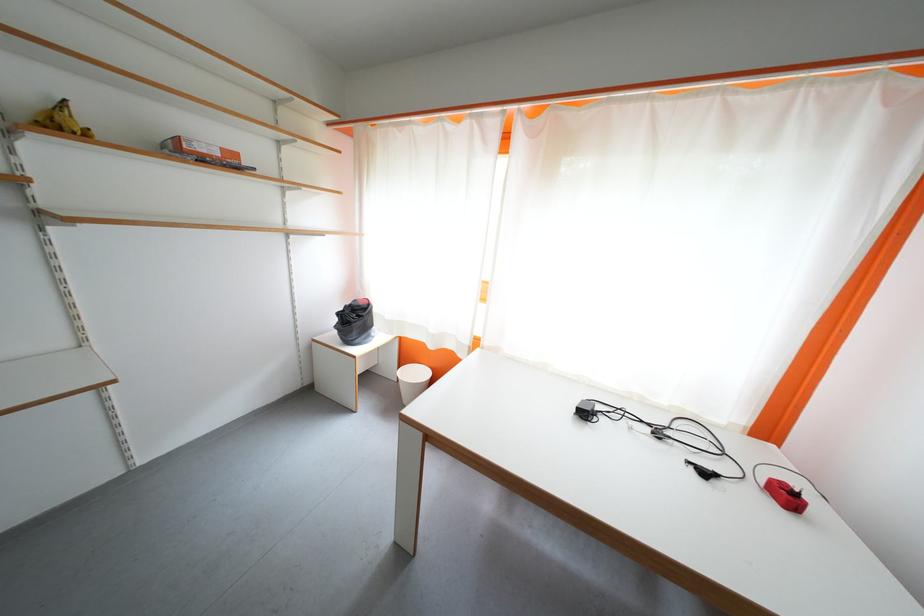
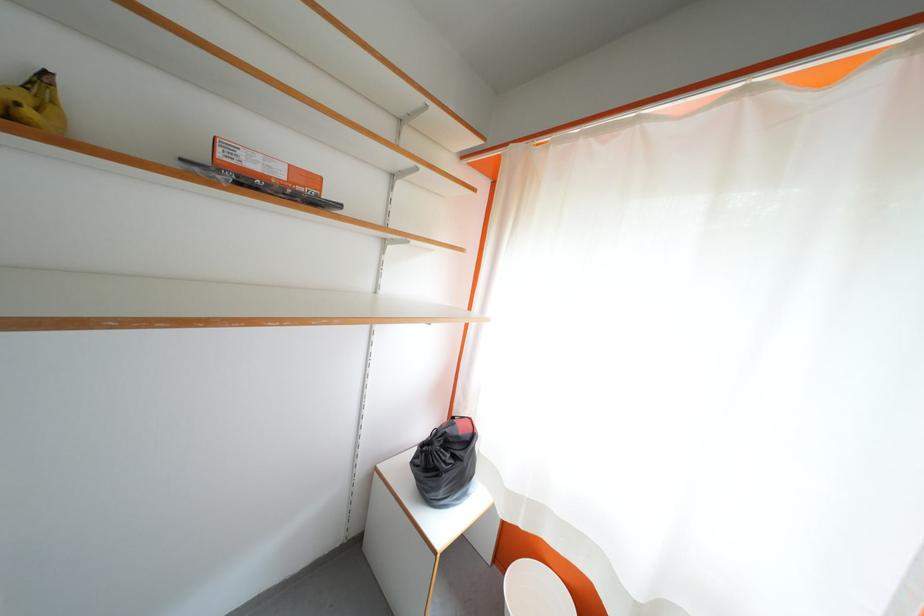
Find the pixel in the second image that matches point 362,322 in the first image.

(455, 460)